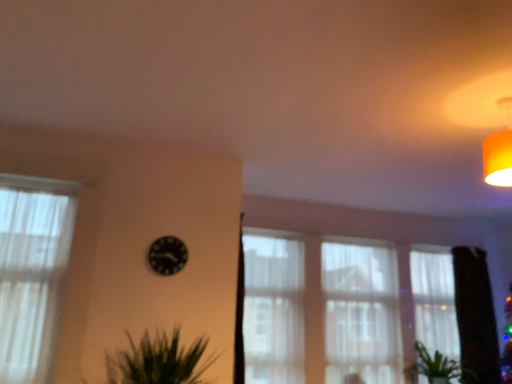
Question: Is white sheer curtain at center, the 2th curtain when ordered from left to right, facing towards black glossy clock at center?

Choices:
 (A) yes
 (B) no

Answer: (B)

Question: Can you confirm if white sheer curtain at center, the 3th curtain when ordered from right to left, is bigger than black glossy clock at center?

Choices:
 (A) no
 (B) yes

Answer: (B)

Question: Is white sheer curtain at center, the 3th curtain when ordered from right to left, turned away from black glossy clock at center?

Choices:
 (A) yes
 (B) no

Answer: (B)

Question: Is black glossy clock at center located within white sheer curtain at center, the third curtain positioned from the back?

Choices:
 (A) no
 (B) yes

Answer: (A)

Question: Can we say white sheer curtain at center, the 2th curtain when ordered from left to right, lies outside black glossy clock at center?

Choices:
 (A) no
 (B) yes

Answer: (B)

Question: From a real-world perspective, is white sheer curtain at center, which is counted as the second curtain, starting from the front, located higher than black glossy clock at center?

Choices:
 (A) no
 (B) yes

Answer: (A)

Question: Does black glossy clock at center have a lesser width compared to white sheer curtain at center, the 3th curtain when ordered from right to left?

Choices:
 (A) yes
 (B) no

Answer: (A)

Question: Is black glossy clock at center oriented towards white sheer curtain at center, the third curtain positioned from the back?

Choices:
 (A) no
 (B) yes

Answer: (A)

Question: Does black glossy clock at center lie in front of white sheer curtain at center, the 3th curtain when ordered from right to left?

Choices:
 (A) no
 (B) yes

Answer: (B)

Question: Is there a large distance between black glossy clock at center and white sheer curtain at center, which is counted as the second curtain, starting from the front?

Choices:
 (A) no
 (B) yes

Answer: (B)

Question: Is the position of black glossy clock at center more distant than that of white sheer curtain at center, which is counted as the second curtain, starting from the front?

Choices:
 (A) no
 (B) yes

Answer: (A)

Question: Considering the relative positions of black glossy clock at center and white sheer curtain at center, the 3th curtain when ordered from right to left, in the image provided, is black glossy clock at center to the right of white sheer curtain at center, the 3th curtain when ordered from right to left, from the viewer's perspective?

Choices:
 (A) no
 (B) yes

Answer: (A)

Question: Would you say white sheer curtain at center, the 2th curtain when ordered from left to right, contains green leafy plant at lower right?

Choices:
 (A) no
 (B) yes

Answer: (A)